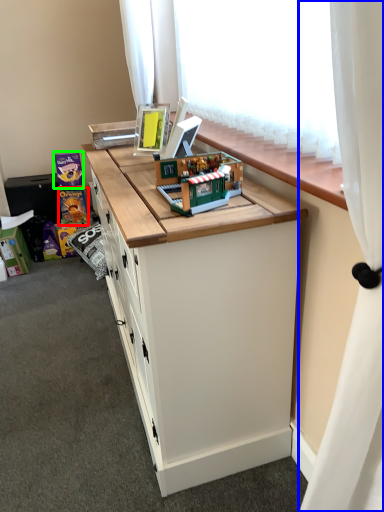
Question: Which is nearer to the toy (highlighted by a red box)? curtain (highlighted by a blue box) or toy (highlighted by a green box).

Choices:
 (A) curtain
 (B) toy

Answer: (B)